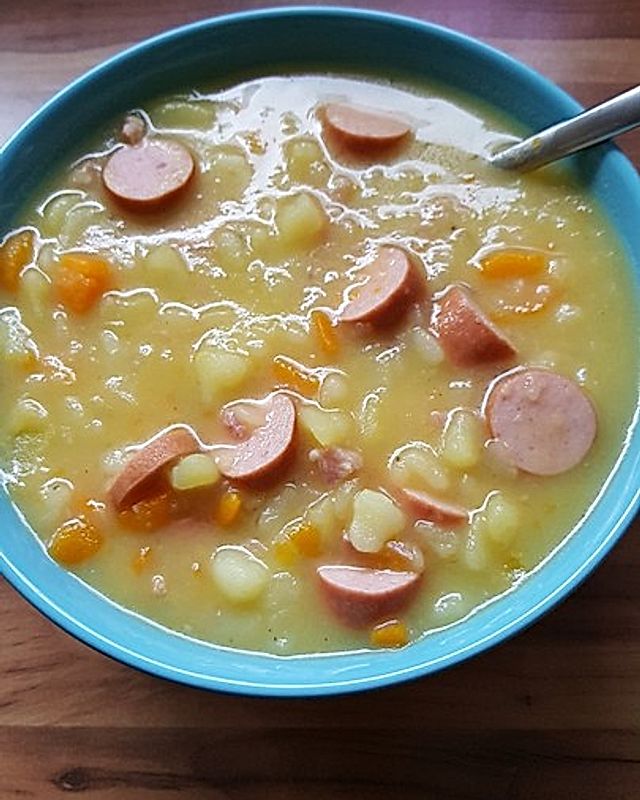
Find the location of a particular element. This screenshot has height=800, width=640. knot in wood surface is located at coordinates (72, 770).